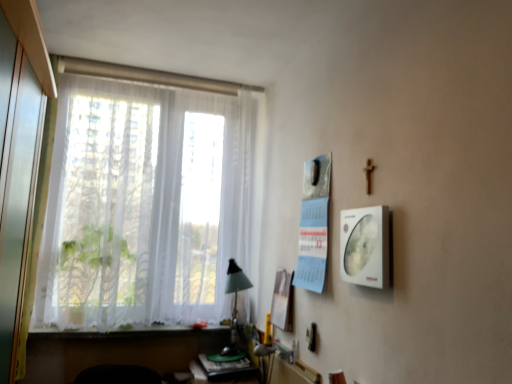
Question: Considering the positions of white glossy picture frame at right and white sheer curtains at left in the image, is white glossy picture frame at right wider or thinner than white sheer curtains at left?

Choices:
 (A) wide
 (B) thin

Answer: (B)

Question: From the image's perspective, relative to white sheer curtains at left, is white glossy picture frame at right above or below?

Choices:
 (A) above
 (B) below

Answer: (B)

Question: Which object is positioned farthest from the white paper at center, marked as the 1th poster page in a bottom-to-top arrangement?

Choices:
 (A) white matte window sill at lower left
 (B) white glossy picture frame at right
 (C) white sheer curtains at left
 (D) transparent glass screen door at left
 (E) wooden table at lower center

Answer: (D)

Question: Which is farther from the white paper calendar at upper right, marked as the 2th poster page in a left-to-right arrangement?

Choices:
 (A) white glossy picture frame at right
 (B) white paper at center, acting as the second poster page starting from the front
 (C) white sheer curtains at left
 (D) transparent glass screen door at left
 (E) white matte window sill at lower left

Answer: (D)